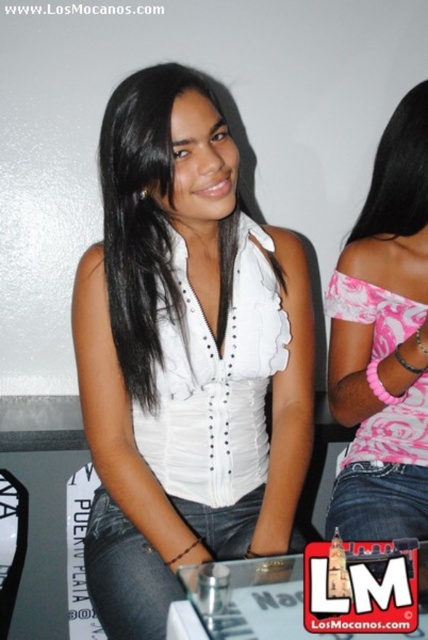
You are a photographer trying to capture a closeup of the pink paisley fabric top at upper right and the jeans at lower right in the image. The camera can only focus on objects within 6 inches of each other. Can you capture both in one shot?

The pink paisley fabric top at upper right is 6.33 inches from the jeans at lower right. Since the distance is more than 6 inches, the camera cannot focus on both in one shot.

You are at a social gathering and see two people. The first person is wearing a white sleeveless top with a ruffled neckline and dark jeans, and has long black hair. The second person is partially visible, wearing a pink and white patterned off the shoulder top and blue jeans, with a pink hair tie on their wrist. You notice the pink paisley fabric top at upper right and the black smooth hair at upper right. Which object is positioned lower in the image?

The pink paisley fabric top at upper right is below black smooth hair at upper right, so the pink paisley fabric top at upper right is positioned lower in the image.

You are trying to decide which item to grab first from the scene. Based on their sizes, which object is bigger between the black smooth hair at upper right and the jeans at lower right?

The black smooth hair at upper right is larger in size than the jeans at lower right, so you should grab the black smooth hair at upper right first since it takes up more space in the scene.